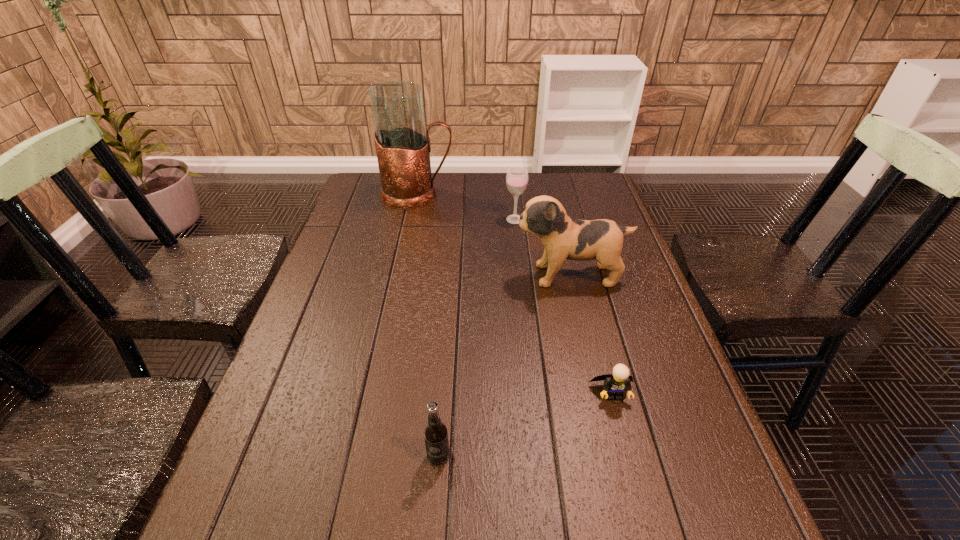
Find the location of a particular element. The width and height of the screenshot is (960, 540). vacant space located at the face of the third farthest object is located at coordinates (427, 275).

Where is `vacant point located at the face of the third farthest object`? The width and height of the screenshot is (960, 540). vacant point located at the face of the third farthest object is located at coordinates (464, 275).

At what (x,y) coordinates should I click in order to perform the action: click on blank space located 0.200m on the left of the fourth nearest object. Please return your answer as a coordinate pair (x, y). Looking at the image, I should click on (442, 219).

Locate an element on the screen. blank space located 0.050m on the label of the nearest object is located at coordinates (436, 496).

This screenshot has width=960, height=540. I want to click on free space located 0.090m on the front-facing side of the fourth farthest object, so click(x=627, y=448).

The height and width of the screenshot is (540, 960). What are the coordinates of `object positioned at the far edge` in the screenshot? It's located at (403, 147).

The image size is (960, 540). I want to click on object that is at the left edge, so click(x=403, y=147).

Where is `puppy situated at the right edge`? This screenshot has height=540, width=960. puppy situated at the right edge is located at coordinates (563, 238).

Locate an element on the screen. Lego present at the right edge is located at coordinates (616, 384).

Locate an element on the screen. Image resolution: width=960 pixels, height=540 pixels. object present at the far left corner is located at coordinates (403, 147).